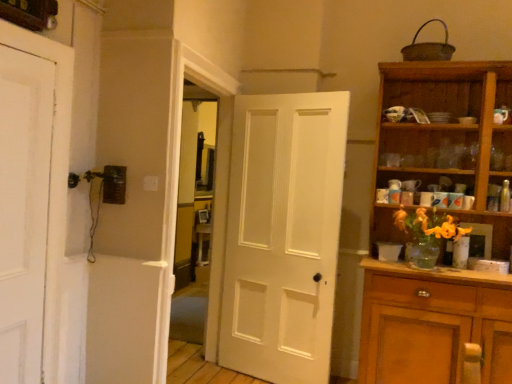
Question: Considering the relative positions of wooden cabinet at right and white matte door at left, which is counted as the 2th door, starting from the right, in the image provided, is wooden cabinet at right behind white matte door at left, which is counted as the 2th door, starting from the right,?

Choices:
 (A) no
 (B) yes

Answer: (B)

Question: Can you confirm if wooden cabinet at right is shorter than white matte door at left, which is counted as the 2th door, starting from the right?

Choices:
 (A) yes
 (B) no

Answer: (B)

Question: Is wooden cabinet at right thinner than white matte door at left, the 1th door positioned from the front?

Choices:
 (A) yes
 (B) no

Answer: (B)

Question: Does wooden cabinet at right contain white matte door at left, the 1th door positioned from the front?

Choices:
 (A) yes
 (B) no

Answer: (B)

Question: Can you confirm if wooden cabinet at right is bigger than white matte door at left, which is counted as the 2th door, starting from the right?

Choices:
 (A) yes
 (B) no

Answer: (A)

Question: From the image's perspective, is white matte door at left, acting as the first door starting from the left, located above or below white matte door at center, which is counted as the 2th door, starting from the front?

Choices:
 (A) above
 (B) below

Answer: (A)

Question: In the image, is white matte door at left, the second door positioned from the back, on the left side or the right side of white matte door at center, the 1th door when ordered from back to front?

Choices:
 (A) right
 (B) left

Answer: (B)

Question: From a real-world perspective, is white matte door at left, the 1th door positioned from the front, physically located above or below white matte door at center, which is counted as the 2th door, starting from the front?

Choices:
 (A) above
 (B) below

Answer: (A)

Question: Is white matte door at left, which is counted as the 2th door, starting from the right, in front of or behind white matte door at center, which is counted as the 2th door, starting from the front, in the image?

Choices:
 (A) behind
 (B) front

Answer: (B)

Question: Is wooden cabinet at right bigger or smaller than white matte door at left, acting as the first door starting from the left?

Choices:
 (A) big
 (B) small

Answer: (A)

Question: Is wooden cabinet at right in front of or behind white matte door at left, the second door positioned from the back, in the image?

Choices:
 (A) front
 (B) behind

Answer: (B)

Question: Considering the relative positions of wooden cabinet at right and white matte door at left, which is counted as the 2th door, starting from the right, in the image provided, is wooden cabinet at right to the left or to the right of white matte door at left, which is counted as the 2th door, starting from the right,?

Choices:
 (A) left
 (B) right

Answer: (B)

Question: From a real-world perspective, is wooden cabinet at right physically located above or below white matte door at left, acting as the first door starting from the left?

Choices:
 (A) below
 (B) above

Answer: (A)

Question: Is point (11, 92) positioned closer to the camera than point (487, 190)?

Choices:
 (A) farther
 (B) closer

Answer: (B)

Question: Do you think white matte door at left, acting as the first door starting from the left, is within wooden cabinet at right, or outside of it?

Choices:
 (A) outside
 (B) inside

Answer: (A)